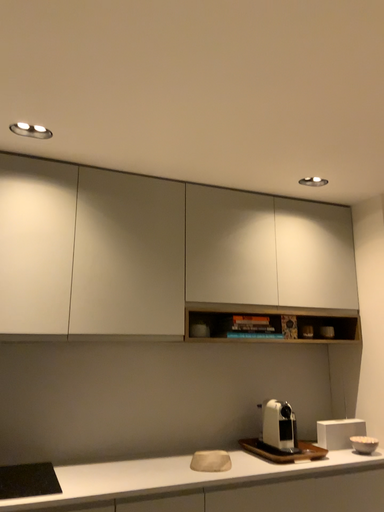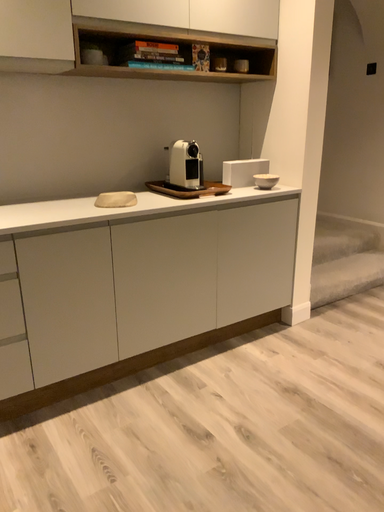
Question: Which way did the camera rotate in the video?

Choices:
 (A) rotated right
 (B) rotated left

Answer: (A)